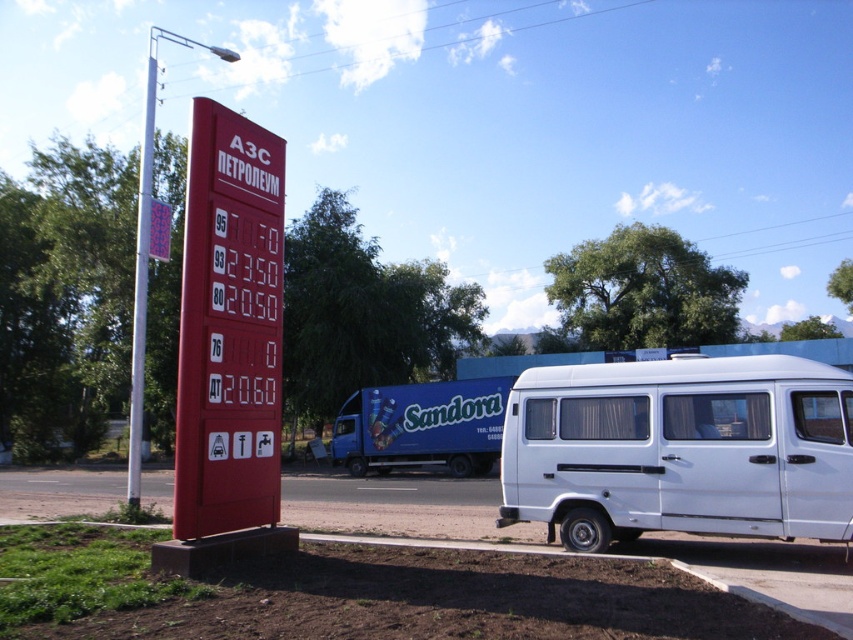
Question: Which of the following is the farthest from the observer?

Choices:
 (A) (148, 90)
 (B) (572, 403)
 (C) (204, 230)
 (D) (138, 202)

Answer: (A)

Question: Considering the relative positions of white matte van at right and smooth red sign at left in the image provided, where is white matte van at right located with respect to smooth red sign at left?

Choices:
 (A) right
 (B) left

Answer: (A)

Question: Considering the relative positions of matte red gas price board at center and smooth red sign at left in the image provided, where is matte red gas price board at center located with respect to smooth red sign at left?

Choices:
 (A) below
 (B) above

Answer: (A)

Question: Which point appears closest to the camera in this image?

Choices:
 (A) (135, 362)
 (B) (212, 524)
 (C) (631, 515)

Answer: (B)

Question: Which object appears farthest from the camera in this image?

Choices:
 (A) white plastic pole at upper left
 (B) matte red gas price board at center
 (C) white matte van at right
 (D) smooth red sign at left

Answer: (D)

Question: Does white matte van at right have a smaller size compared to white plastic pole at upper left?

Choices:
 (A) yes
 (B) no

Answer: (A)